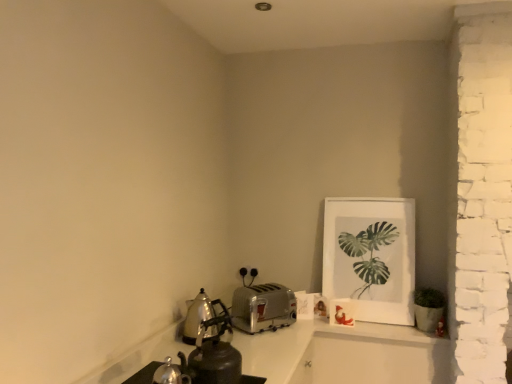
The width and height of the screenshot is (512, 384). What do you see at coordinates (371, 256) in the screenshot? I see `white matte picture frame at upper right` at bounding box center [371, 256].

Describe the element at coordinates (263, 308) in the screenshot. I see `silver metallic toaster at center, the first kitchen appliance viewed from the right` at that location.

Measure the distance between point (205, 334) and camera.

Point (205, 334) is 1.74 meters from camera.

How much space does polished stainless steel kettle at left, which is the first kitchen appliance in left-to-right order, occupy horizontally?

The width of polished stainless steel kettle at left, which is the first kitchen appliance in left-to-right order, is 9.88 inches.

Find the location of a particular element. This screenshot has width=512, height=384. white matte picture frame at upper right is located at coordinates (371, 256).

Would you say white matte picture frame at upper right is a long distance from polished stainless steel kettle at left, the second kitchen appliance positioned from the right?

That's not correct — white matte picture frame at upper right is a little close to polished stainless steel kettle at left, the second kitchen appliance positioned from the right.

Considering the positions of points (372, 245) and (200, 311), is point (372, 245) closer to camera compared to point (200, 311)?

That is False.

Between white matte picture frame at upper right and polished stainless steel kettle at left, the second kitchen appliance positioned from the right, which one has more height?

Standing taller between the two is white matte picture frame at upper right.

From the image's perspective, is white matte picture frame at upper right over polished stainless steel kettle at left, the second kitchen appliance positioned from the right?

Yes, from the image's perspective, white matte picture frame at upper right is on top of polished stainless steel kettle at left, the second kitchen appliance positioned from the right.

How much distance is there between polished stainless steel kettle at left, which is the first kitchen appliance in left-to-right order, and white matte picture frame at upper right?

polished stainless steel kettle at left, which is the first kitchen appliance in left-to-right order, and white matte picture frame at upper right are 38.30 inches apart.

Considering the positions of objects polished stainless steel kettle at left, the second kitchen appliance positioned from the right, and white matte picture frame at upper right in the image provided, who is in front, polished stainless steel kettle at left, the second kitchen appliance positioned from the right, or white matte picture frame at upper right?

polished stainless steel kettle at left, the second kitchen appliance positioned from the right.

Which is correct: polished stainless steel kettle at left, the second kitchen appliance positioned from the right, is inside white matte picture frame at upper right, or outside of it?

polished stainless steel kettle at left, the second kitchen appliance positioned from the right, is located beyond the bounds of white matte picture frame at upper right.

Does polished stainless steel kettle at left, which is the first kitchen appliance in left-to-right order, have a larger size compared to white matte picture frame at upper right?

Actually, polished stainless steel kettle at left, which is the first kitchen appliance in left-to-right order, might be smaller than white matte picture frame at upper right.

Can you confirm if shiny metallic kettle at lower left is positioned to the right of white matte picture frame at upper right?

In fact, shiny metallic kettle at lower left is to the left of white matte picture frame at upper right.

From a real-world perspective, is shiny metallic kettle at lower left on white matte picture frame at upper right?

No.

Is shiny metallic kettle at lower left facing towards white matte picture frame at upper right?

No, shiny metallic kettle at lower left is not oriented towards white matte picture frame at upper right.

In the scene shown: Is white matte picture frame at upper right facing away from silver metallic toaster at center, the second kitchen appliance from the left?

white matte picture frame at upper right does not have its back to silver metallic toaster at center, the second kitchen appliance from the left.

The width and height of the screenshot is (512, 384). Identify the location of kitchen appliance that is the 2nd one when counting downward from the white matte picture frame at upper right (from the image's perspective). (263, 308).

Can silver metallic toaster at center, the second kitchen appliance from the left, be found inside white matte picture frame at upper right?

No.

Can you confirm if polished stainless steel kettle at left, the second kitchen appliance positioned from the right, is positioned to the right of shiny metallic kettle at lower left?

Incorrect, polished stainless steel kettle at left, the second kitchen appliance positioned from the right, is not on the right side of shiny metallic kettle at lower left.

From the picture: Is shiny metallic kettle at lower left at the back of polished stainless steel kettle at left, the second kitchen appliance positioned from the right?

polished stainless steel kettle at left, the second kitchen appliance positioned from the right, is not turned away from shiny metallic kettle at lower left.

In the image, there is a polished stainless steel kettle at left, which is the first kitchen appliance in left-to-right order. In order to click on tea pot below it (from the image's perspective) in this screenshot , I will do `click(213, 356)`.

From the picture: Are polished stainless steel kettle at left, which is the first kitchen appliance in left-to-right order, and shiny metallic kettle at lower left beside each other?

No.

Is shiny metallic kettle at lower left beside polished stainless steel kettle at left, the second kitchen appliance positioned from the right?

No.

From a real-world perspective, is shiny metallic kettle at lower left located higher than polished stainless steel kettle at left, the second kitchen appliance positioned from the right?

Incorrect, from a real-world perspective, shiny metallic kettle at lower left is lower than polished stainless steel kettle at left, the second kitchen appliance positioned from the right.

Between point (230, 350) and point (216, 312), which one is positioned in front?

The point (230, 350) is closer.

Considering the positions of objects shiny metallic kettle at lower left and polished stainless steel kettle at left, which is the first kitchen appliance in left-to-right order, in the image provided, who is behind, shiny metallic kettle at lower left or polished stainless steel kettle at left, which is the first kitchen appliance in left-to-right order,?

polished stainless steel kettle at left, which is the first kitchen appliance in left-to-right order, is behind.

From the image's perspective, is shiny metallic kettle at lower left above or below silver metallic toaster at center, the second kitchen appliance from the left?

shiny metallic kettle at lower left is above silver metallic toaster at center, the second kitchen appliance from the left.

Do you think shiny metallic kettle at lower left is within silver metallic toaster at center, the first kitchen appliance viewed from the right, or outside of it?

shiny metallic kettle at lower left is not enclosed by silver metallic toaster at center, the first kitchen appliance viewed from the right.

Consider the image. Which is behind, shiny metallic kettle at lower left or silver metallic toaster at center, the first kitchen appliance viewed from the right?

silver metallic toaster at center, the first kitchen appliance viewed from the right, is further from the camera.

From a real-world perspective, is shiny metallic kettle at lower left located higher than silver metallic toaster at center, the second kitchen appliance from the left?

Yes, from a real-world perspective, shiny metallic kettle at lower left is above silver metallic toaster at center, the second kitchen appliance from the left.

You are a GUI agent. You are given a task and a screenshot of the screen. Output one action in this format:
    pyautogui.click(x=<x>, y=<y>)
    Task: Click on the 1st kitchen appliance below the white matte picture frame at upper right (from the image's perspective)
    
    Given the screenshot: What is the action you would take?
    (x=200, y=315)

Find the location of a particular element. Image resolution: width=512 pixels, height=384 pixels. the 2nd kitchen appliance in front of the white matte picture frame at upper right is located at coordinates (200, 315).

When comparing their distances from white matte picture frame at upper right, does shiny metallic kettle at lower left or polished stainless steel kettle at left, the second kitchen appliance positioned from the right, seem closer?

polished stainless steel kettle at left, the second kitchen appliance positioned from the right, is closer to white matte picture frame at upper right.

From the image, which object appears to be farther from silver metallic toaster at center, the first kitchen appliance viewed from the right, shiny metallic kettle at lower left or polished stainless steel kettle at left, which is the first kitchen appliance in left-to-right order?

shiny metallic kettle at lower left.

Which object lies further to the anchor point shiny metallic kettle at lower left, white matte picture frame at upper right or silver metallic toaster at center, the first kitchen appliance viewed from the right?

white matte picture frame at upper right lies further to shiny metallic kettle at lower left than the other object.

Estimate the real-world distances between objects in this image. Which object is further from silver metallic toaster at center, the first kitchen appliance viewed from the right, shiny metallic kettle at lower left or white matte picture frame at upper right?

shiny metallic kettle at lower left lies further to silver metallic toaster at center, the first kitchen appliance viewed from the right, than the other object.

Looking at the image, which one is located closer to polished stainless steel kettle at left, which is the first kitchen appliance in left-to-right order, white matte picture frame at upper right or silver metallic toaster at center, the second kitchen appliance from the left?

silver metallic toaster at center, the second kitchen appliance from the left.

Considering their positions, is silver metallic toaster at center, the second kitchen appliance from the left, positioned closer to shiny metallic kettle at lower left than polished stainless steel kettle at left, the second kitchen appliance positioned from the right?

Based on the image, polished stainless steel kettle at left, the second kitchen appliance positioned from the right, appears to be nearer to shiny metallic kettle at lower left.

From the image, which object appears to be farther from polished stainless steel kettle at left, which is the first kitchen appliance in left-to-right order, white matte picture frame at upper right or shiny metallic kettle at lower left?

white matte picture frame at upper right is further to polished stainless steel kettle at left, which is the first kitchen appliance in left-to-right order.

Looking at the image, which one is located further to silver metallic toaster at center, the first kitchen appliance viewed from the right, white matte picture frame at upper right or polished stainless steel kettle at left, which is the first kitchen appliance in left-to-right order?

white matte picture frame at upper right is further to silver metallic toaster at center, the first kitchen appliance viewed from the right.

Locate an element on the screen. Image resolution: width=512 pixels, height=384 pixels. tea pot between polished stainless steel kettle at left, the second kitchen appliance positioned from the right, and white matte picture frame at upper right from left to right is located at coordinates (213, 356).

I want to click on kitchen appliance between polished stainless steel kettle at left, which is the first kitchen appliance in left-to-right order, and white matte picture frame at upper right, in the horizontal direction, so click(x=263, y=308).

I want to click on kitchen appliance between shiny metallic kettle at lower left and silver metallic toaster at center, the first kitchen appliance viewed from the right, along the z-axis, so click(200, 315).